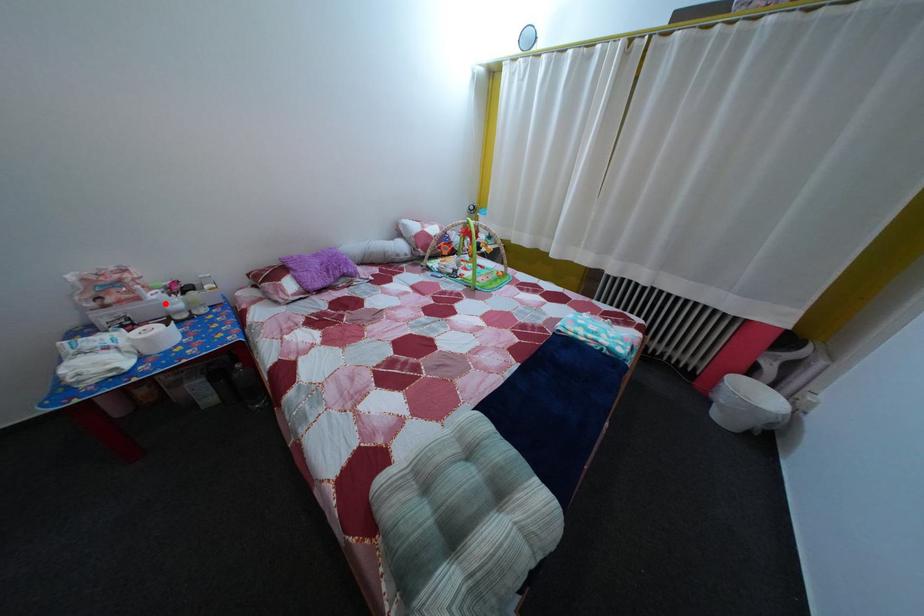
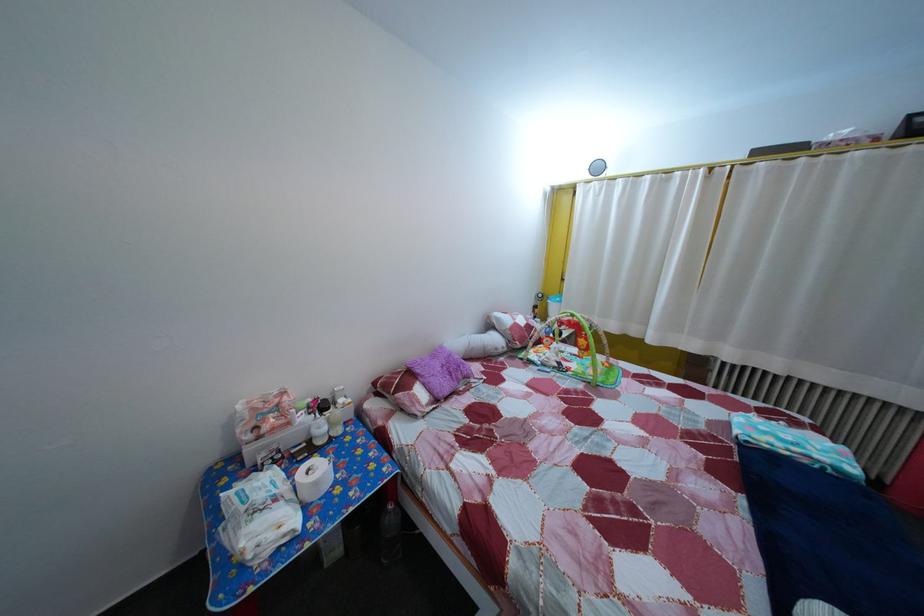
In the second image, find the point that corresponds to the highlighted location in the first image.

(311, 427)